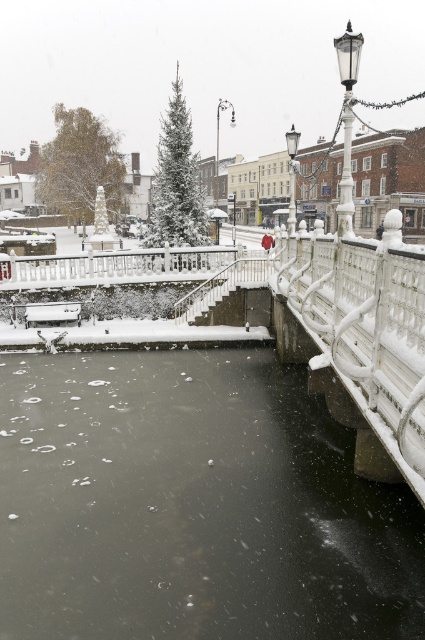
Question: Observing the image, what is the correct spatial positioning of black ice at center in reference to white glossy rail at right?

Choices:
 (A) left
 (B) right

Answer: (A)

Question: Which point is farther to the camera?

Choices:
 (A) black ice at center
 (B) white glossy rail at right

Answer: (A)

Question: Does white glossy rail at right appear over polished brass streetlamp at upper right?

Choices:
 (A) no
 (B) yes

Answer: (A)

Question: Which object appears closest to the camera in this image?

Choices:
 (A) white glossy rail at center
 (B) black ice at center
 (C) polished brass streetlamp at upper right
 (D) white glass lamp post at upper right

Answer: (B)

Question: Which object is closer to the camera taking this photo?

Choices:
 (A) black ice at center
 (B) white glass lamp post at upper right
 (C) white glossy rail at center
 (D) white glossy rail at right

Answer: (D)

Question: Where is black ice at center located in relation to white glass lamp post at upper right in the image?

Choices:
 (A) left
 (B) right

Answer: (A)